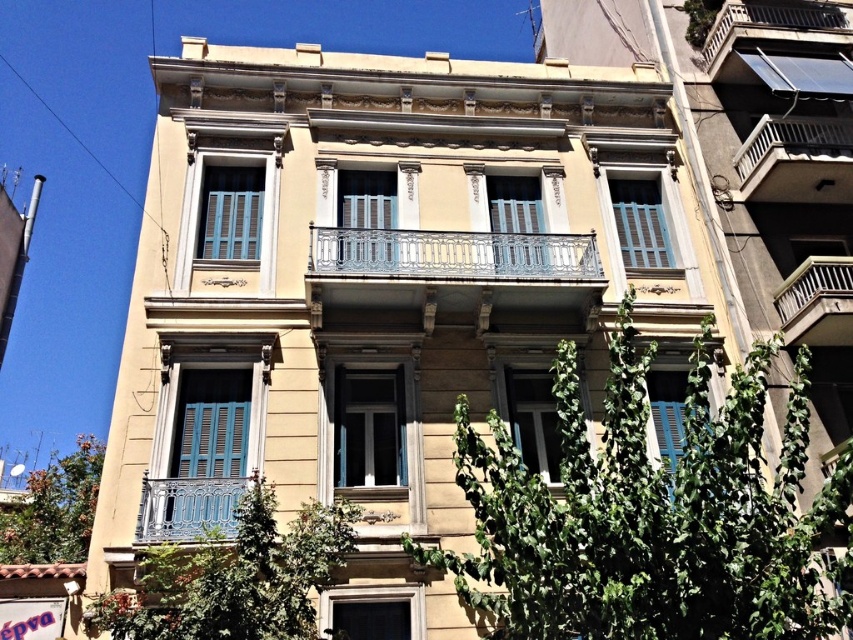
You are standing in front of the residential building and notice two balconies. One is the metallic wrought iron balcony at center and the other is the metallic wrought iron balcony at upper right. Which balcony is closer to you?

The metallic wrought iron balcony at center is closer to you because it is in front of the metallic wrought iron balcony at upper right.

You are an architect evaluating the building. You need to determine which of the two metallic balconies, the metallic wrought iron balcony at center or the metallic wrought iron balcony at right, has a bigger area for placing potted plants. Based on the description, which one would you recommend?

The metallic wrought iron balcony at center has a larger size compared to the metallic wrought iron balcony at right, so it provides more space for placing potted plants.